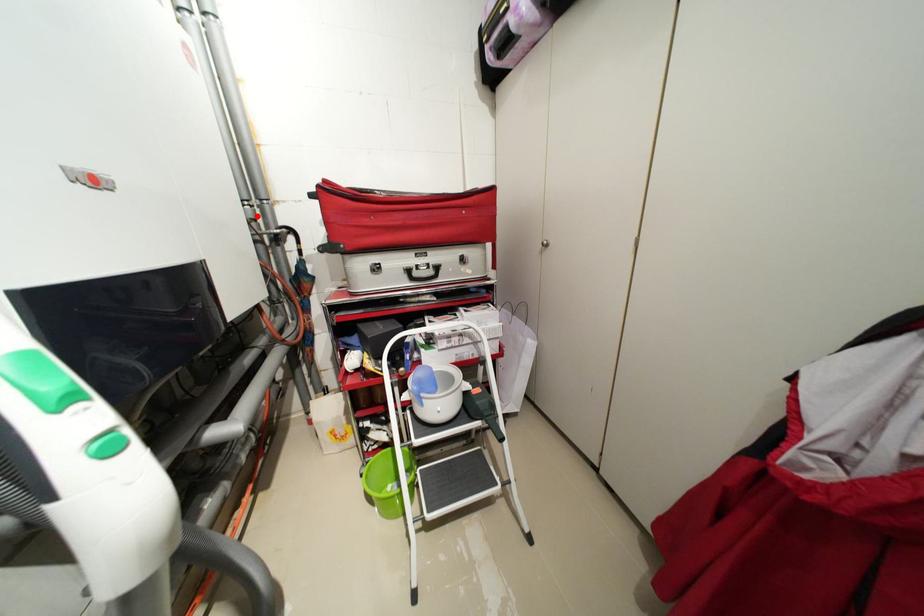
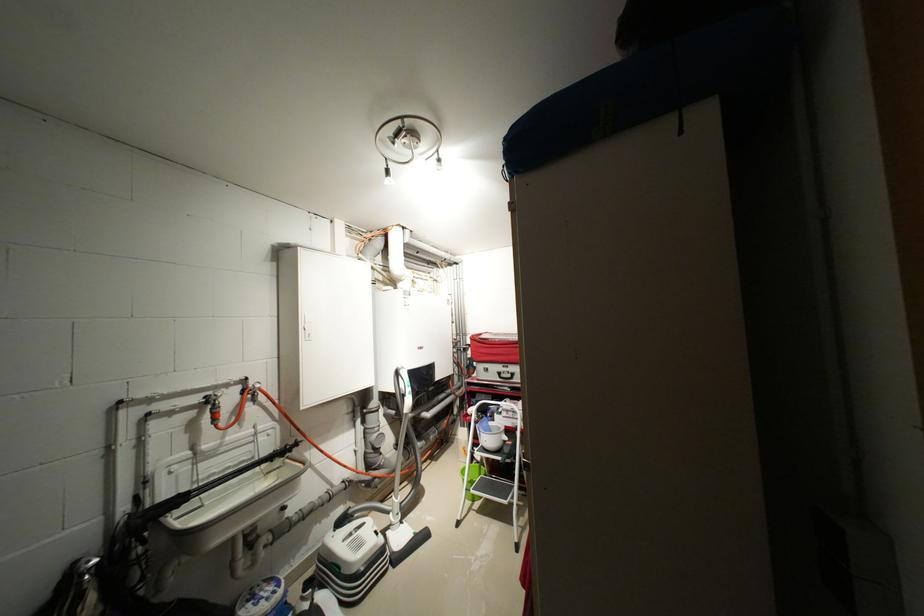
Question: I am providing you with two images of the same scene from different viewpoints. Image1 has a red point marked. In image2, the corresponding 3D location appears at what relative position? Reply with the corresponding letter.

Choices:
 (A) Closer
 (B) Farther

Answer: (B)